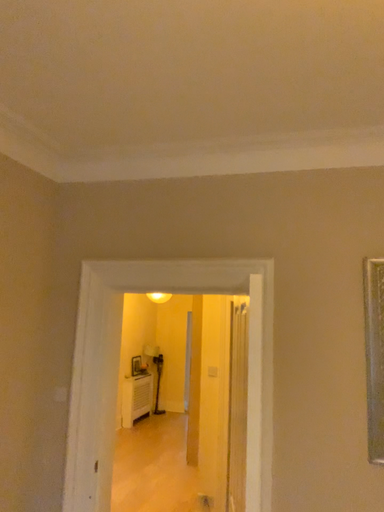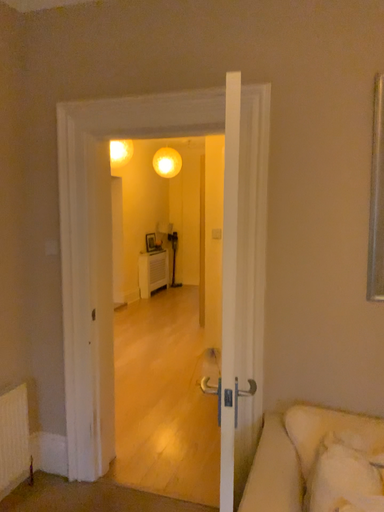
Question: How did the camera likely rotate when shooting the video?

Choices:
 (A) rotated downward
 (B) rotated upward

Answer: (A)